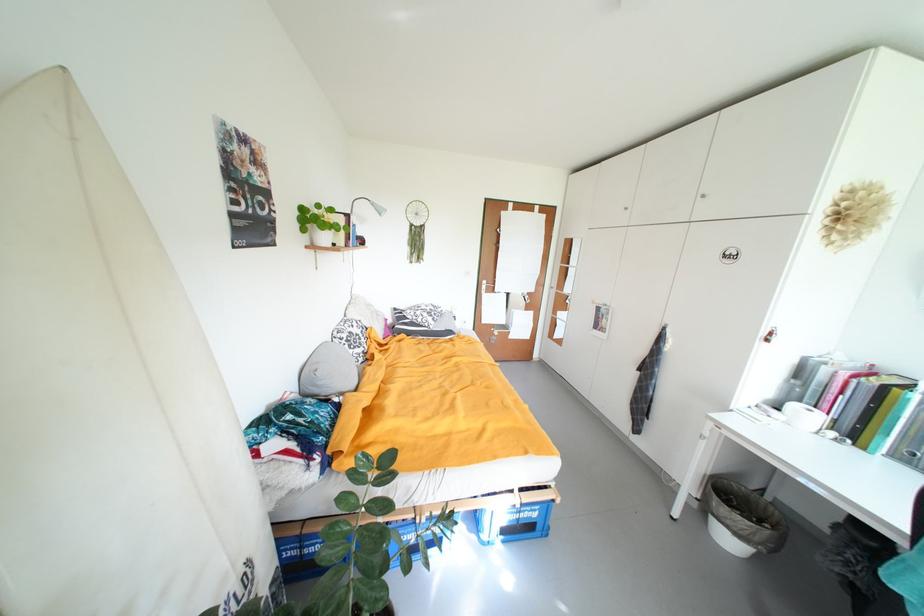
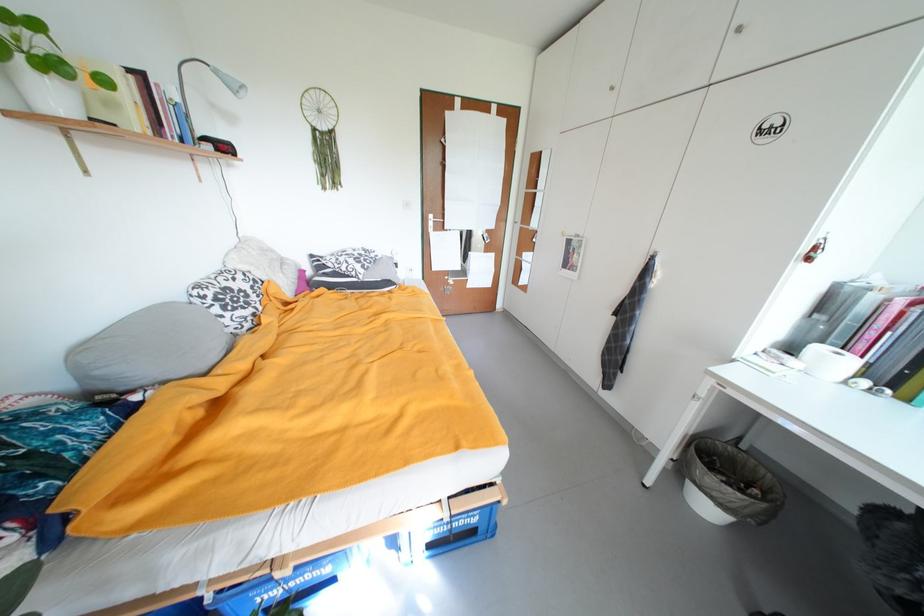
Find the pixel in the second image that matches pixel 349 341 in the first image.

(211, 299)